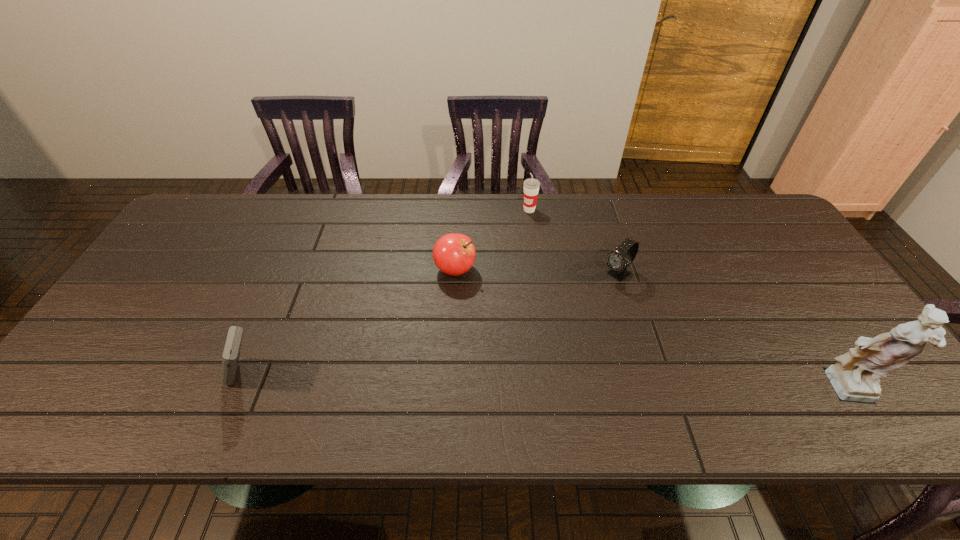
Image resolution: width=960 pixels, height=540 pixels. Find the location of `calculator`. calculator is located at coordinates (231, 353).

Find the location of `the tallest object`. the tallest object is located at coordinates (855, 377).

Locate an element on the screen. figurine is located at coordinates (855, 377).

Image resolution: width=960 pixels, height=540 pixels. Identify the location of the second object from left to right. (454, 254).

You are a GUI agent. You are given a task and a screenshot of the screen. Output one action in this format:
    pyautogui.click(x=<x>, y=<y>)
    Task: Click on the fourth object from left to right
    
    Given the screenshot: What is the action you would take?
    pyautogui.click(x=619, y=259)

Where is `the third object from right to left`? the third object from right to left is located at coordinates (531, 186).

This screenshot has width=960, height=540. I want to click on the farthest object, so click(531, 186).

This screenshot has height=540, width=960. I want to click on free space located 0.150m on the front-facing side of the leftmost object, so click(x=159, y=376).

This screenshot has width=960, height=540. What are the coordinates of `vacant space located on the front-facing side of the leftmost object` in the screenshot? It's located at (76, 376).

I want to click on vacant region located on the front-facing side of the leftmost object, so click(x=93, y=376).